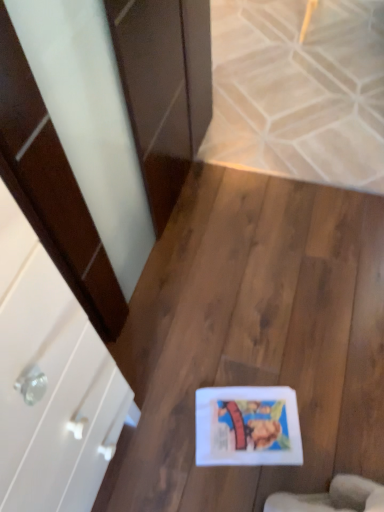
At what (x,y) coordinates should I click in order to perform the action: click on free space to the right of white glossy cabinet at left. Please return your answer as a coordinate pair (x, y). The image size is (384, 512). Looking at the image, I should click on pos(200,434).